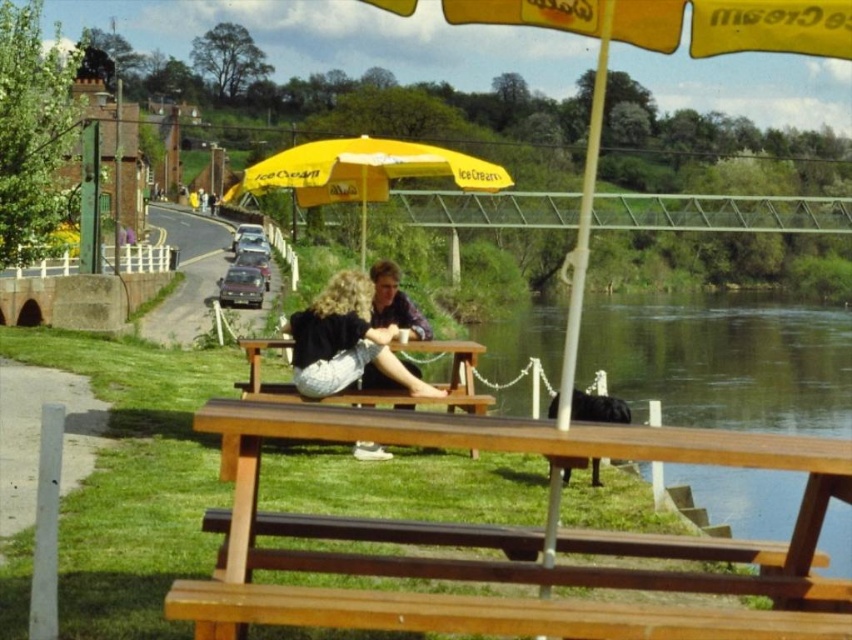
In the scene shown: Does green smooth water at lower right have a greater width compared to denim skirt at center?

Yes, green smooth water at lower right is wider than denim skirt at center.

Is green smooth water at lower right smaller than denim skirt at center?

No, green smooth water at lower right is not smaller than denim skirt at center.

Is point (728, 506) closer to camera compared to point (297, 369)?

That is False.

At what (x,y) coordinates should I click in order to perform the action: click on green smooth water at lower right. Please return your answer as a coordinate pair (x, y). Looking at the image, I should click on (723, 360).

Is brown wooden bench at lower center to the left of matte blue shirt at center from the viewer's perspective?

Incorrect, brown wooden bench at lower center is not on the left side of matte blue shirt at center.

Can you confirm if brown wooden bench at lower center is wider than matte blue shirt at center?

Yes.

This screenshot has width=852, height=640. I want to click on brown wooden bench at lower center, so click(508, 580).

This screenshot has width=852, height=640. Find the location of `brown wooden bench at lower center`. brown wooden bench at lower center is located at coordinates (508, 580).

How far apart are green smooth water at lower right and matte blue shirt at center?

green smooth water at lower right is 161.67 feet from matte blue shirt at center.

Looking at this image, can you confirm if green smooth water at lower right is positioned to the right of matte blue shirt at center?

Correct, you'll find green smooth water at lower right to the right of matte blue shirt at center.

Which is in front, point (522, 381) or point (381, 291)?

Point (381, 291) is more forward.

Identify the location of green smooth water at lower right. This screenshot has width=852, height=640. (723, 360).